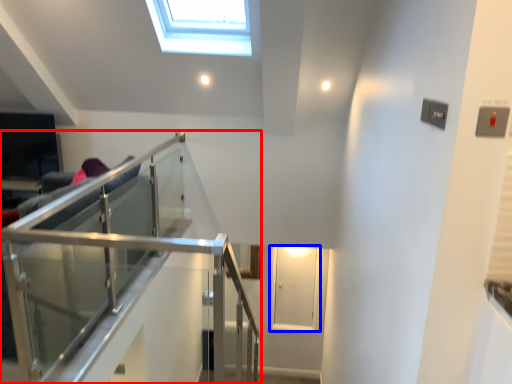
Question: Which of the following is the closest to the observer, balcony (highlighted by a red box) or glass door (highlighted by a blue box)?

Choices:
 (A) balcony
 (B) glass door

Answer: (A)